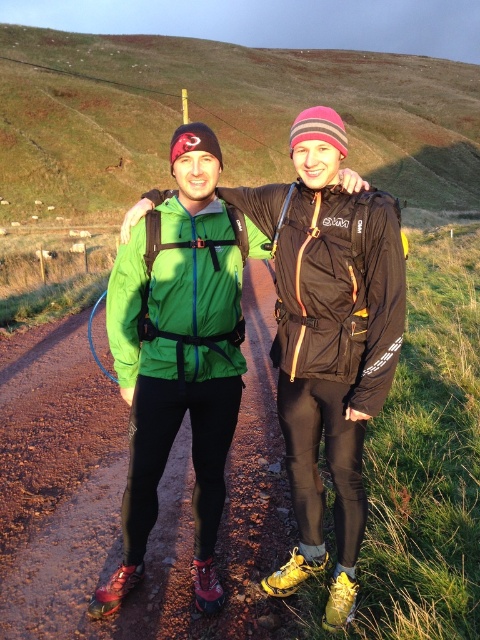
Question: Is green fabric jacket at upper center thinner than green matte jacket at center?

Choices:
 (A) no
 (B) yes

Answer: (A)

Question: Which object appears farthest from the camera in this image?

Choices:
 (A) green matte jacket at center
 (B) green fabric jacket at upper center

Answer: (B)

Question: Observing the image, what is the correct spatial positioning of green fabric jacket at upper center in reference to green matte jacket at center?

Choices:
 (A) right
 (B) left

Answer: (B)

Question: Observing the image, what is the correct spatial positioning of green fabric jacket at upper center in reference to green matte jacket at center?

Choices:
 (A) below
 (B) above

Answer: (B)

Question: Among these objects, which one is farthest from the camera?

Choices:
 (A) green fabric jacket at upper center
 (B) green matte jacket at center

Answer: (A)